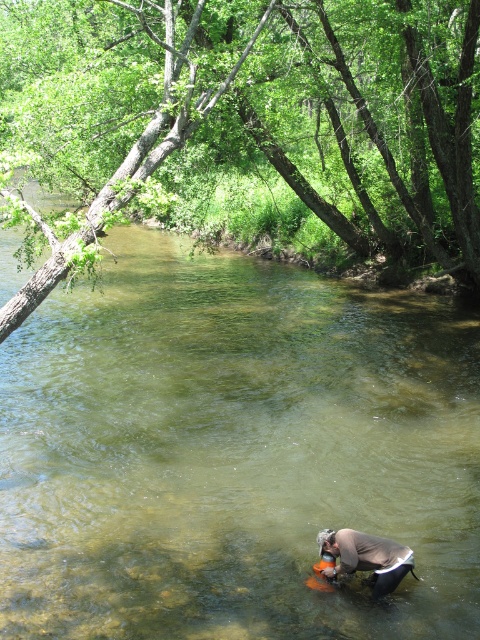
Question: Does green leafy tree at upper left appear under light brown fabric at lower center?

Choices:
 (A) yes
 (B) no

Answer: (B)

Question: Estimate the real-world distances between objects in this image. Which object is closer to the clear water at center?

Choices:
 (A) green leafy tree at upper left
 (B) light brown fabric at lower center

Answer: (B)

Question: Which point is farther from the camera taking this photo?

Choices:
 (A) (189, 284)
 (B) (289, 64)

Answer: (A)

Question: Is clear water at center above green leafy tree at upper left?

Choices:
 (A) no
 (B) yes

Answer: (A)

Question: Which of the following is the farthest from the observer?

Choices:
 (A) (121, 428)
 (B) (407, 220)

Answer: (B)

Question: Does green leafy tree at upper left have a lesser width compared to light brown fabric at lower center?

Choices:
 (A) yes
 (B) no

Answer: (B)